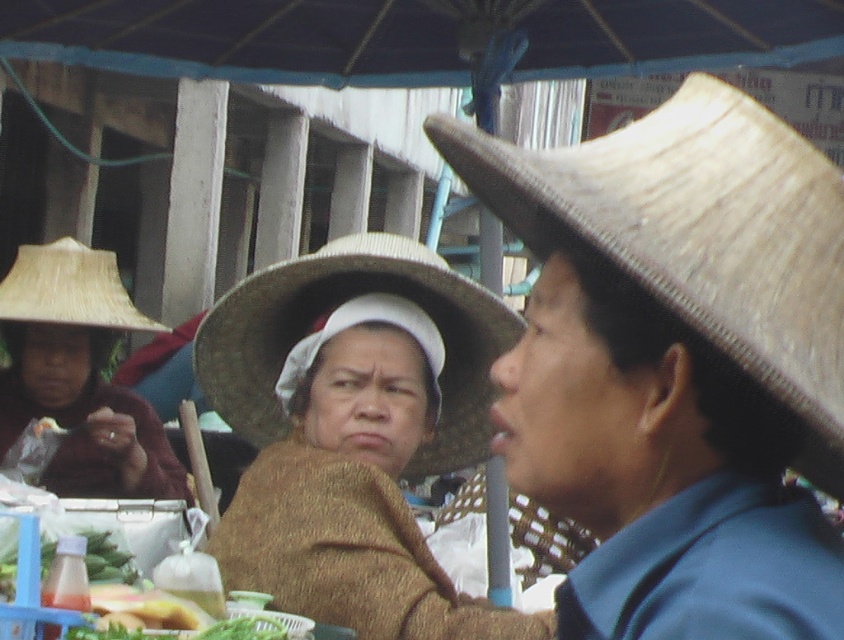
You are at an outdoor market and see two straw hats displayed on a table. The hats are labeled as the brown straw hat at center and the natural straw hat at left. Which hat is located to the right of the other?

The brown straw hat at center is positioned on the right side of natural straw hat at left.

You are at an outdoor market and see two straw hats displayed on a table. The bleached straw hat at center and the natural straw hat at left. Which one is smaller in size?

The bleached straw hat at center has a smaller size compared to the natural straw hat at left, so the bleached straw hat at center is smaller.